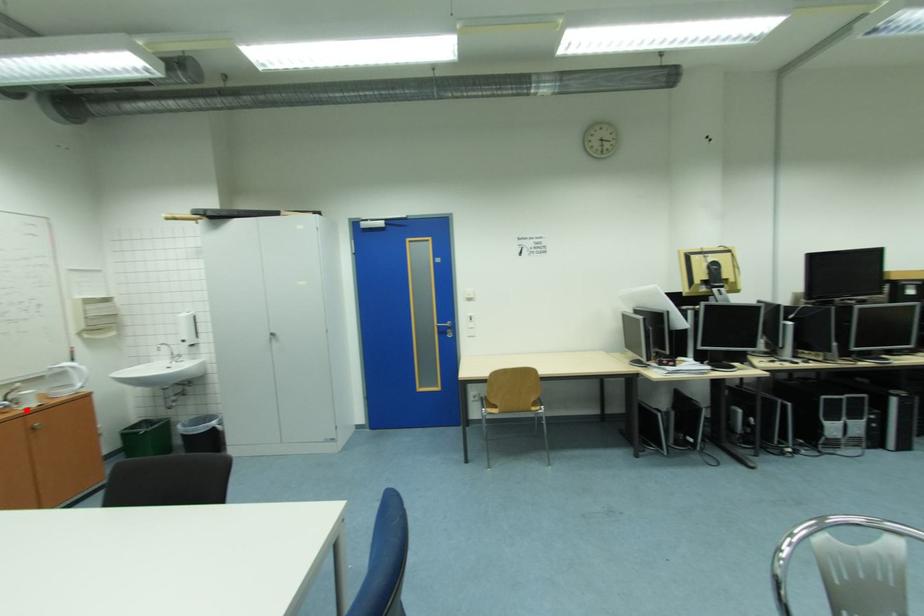
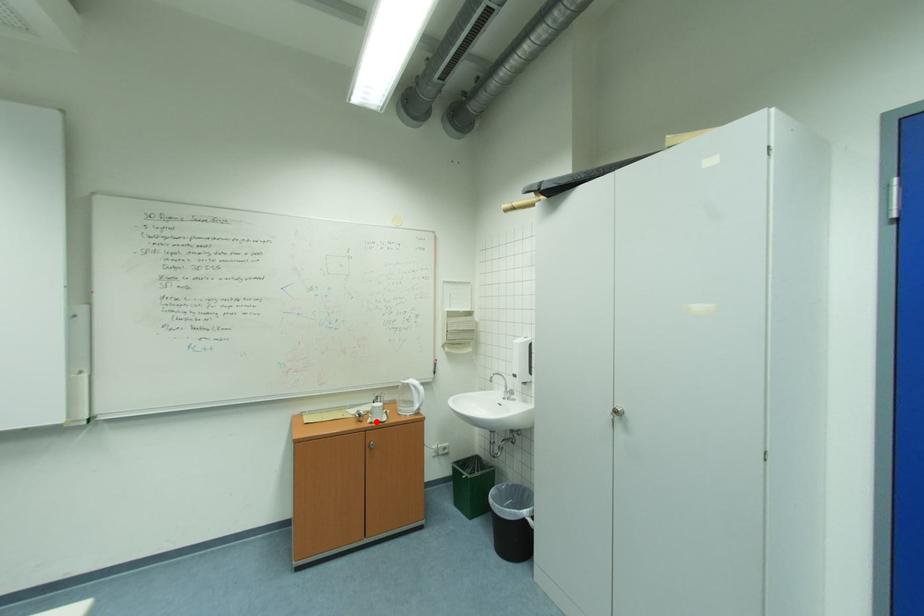
I am providing you with two images of the same scene from different viewpoints. A red point is marked on the first image and another point is marked on the second image. Does the point marked in image1 correspond to the same location as the one in image2?

Yes